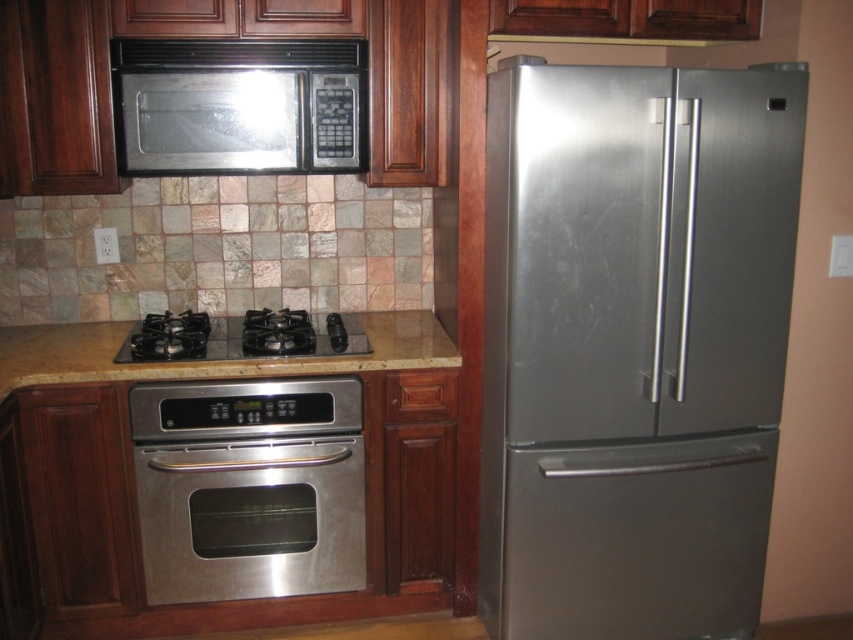
Question: Does black matte exhaust hood at upper center come in front of black glass stove at center?

Choices:
 (A) no
 (B) yes

Answer: (B)

Question: Estimate the real-world distances between objects in this image. Which object is closer to the black matte exhaust hood at upper center?

Choices:
 (A) stainless steel oven at center
 (B) stainless steel microwave at upper center
 (C) beige marble countertop at center
 (D) black glass stove at center

Answer: (B)

Question: Which object is farther from the camera taking this photo?

Choices:
 (A) stainless steel microwave at upper center
 (B) black matte exhaust hood at upper center
 (C) stainless steel refrigerator at right

Answer: (A)

Question: Considering the relative positions of stainless steel microwave at upper center and beige marble countertop at center in the image provided, where is stainless steel microwave at upper center located with respect to beige marble countertop at center?

Choices:
 (A) below
 (B) above

Answer: (B)

Question: Does stainless steel oven at center appear over beige marble countertop at center?

Choices:
 (A) yes
 (B) no

Answer: (B)

Question: Which of the following is the farthest from the observer?

Choices:
 (A) stainless steel refrigerator at right
 (B) stainless steel microwave at upper center

Answer: (B)